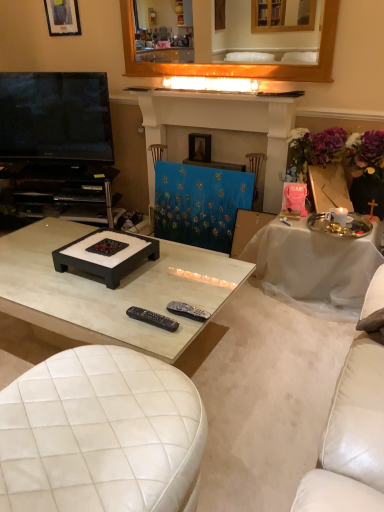
Question: Does shiny silver tray at upper right turn towards white glossy coffee table at center?

Choices:
 (A) no
 (B) yes

Answer: (A)

Question: Is shiny silver tray at upper right wider than white glossy coffee table at center?

Choices:
 (A) yes
 (B) no

Answer: (B)

Question: Considering the relative sizes of shiny silver tray at upper right and white glossy coffee table at center in the image provided, is shiny silver tray at upper right bigger than white glossy coffee table at center?

Choices:
 (A) no
 (B) yes

Answer: (A)

Question: Would you say shiny silver tray at upper right is outside white glossy coffee table at center?

Choices:
 (A) no
 (B) yes

Answer: (B)

Question: Can you confirm if shiny silver tray at upper right is taller than white glossy coffee table at center?

Choices:
 (A) no
 (B) yes

Answer: (B)

Question: Can you confirm if shiny silver tray at upper right is positioned to the right of white glossy coffee table at center?

Choices:
 (A) yes
 (B) no

Answer: (A)

Question: Is shiny silver tray at upper right to the right of matte black picture frame at upper left, the 1th picture frame in the left-to-right sequence, from the viewer's perspective?

Choices:
 (A) yes
 (B) no

Answer: (A)

Question: Does shiny silver tray at upper right have a larger size compared to matte black picture frame at upper left, which is counted as the second picture frame, starting from the bottom?

Choices:
 (A) yes
 (B) no

Answer: (A)

Question: From a real-world perspective, is shiny silver tray at upper right below matte black picture frame at upper left, the second picture frame viewed from the right?

Choices:
 (A) yes
 (B) no

Answer: (A)

Question: Does shiny silver tray at upper right have a smaller size compared to matte black picture frame at upper left, which is counted as the second picture frame, starting from the bottom?

Choices:
 (A) yes
 (B) no

Answer: (B)

Question: Could matte black picture frame at upper left, which is counted as the second picture frame, starting from the bottom, be considered to be inside shiny silver tray at upper right?

Choices:
 (A) no
 (B) yes

Answer: (A)

Question: Is shiny silver tray at upper right looking in the opposite direction of matte black picture frame at upper left, the second picture frame viewed from the right?

Choices:
 (A) yes
 (B) no

Answer: (B)

Question: Can you confirm if black plastic entertainment center at left is bigger than black plastic remote at center, the second remote control from the left?

Choices:
 (A) no
 (B) yes

Answer: (B)